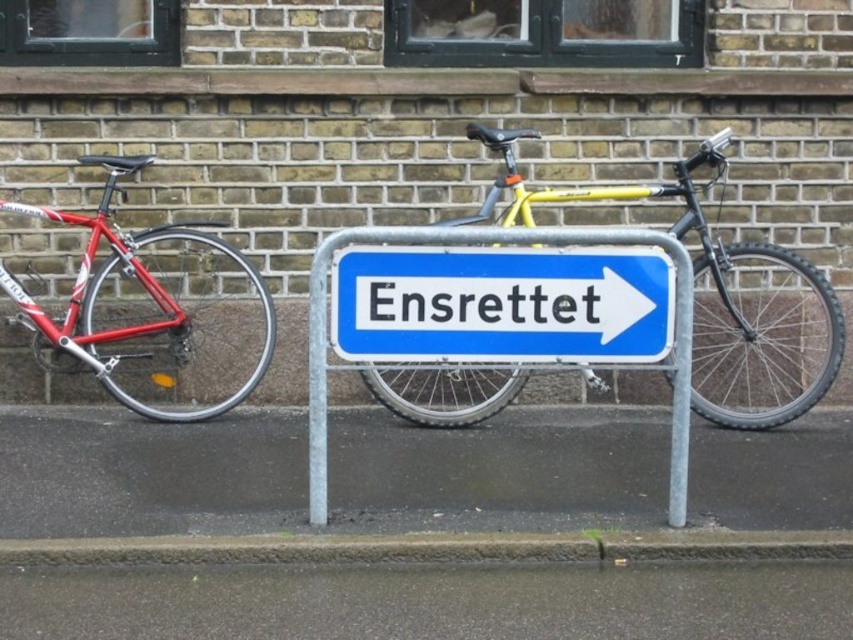
Question: Which object appears farthest from the camera in this image?

Choices:
 (A) gray metallic pole at center
 (B) blue metallic sign at center

Answer: (B)

Question: Does blue metallic sign at center have a lesser width compared to metallic blue sign at center?

Choices:
 (A) no
 (B) yes

Answer: (B)

Question: Can you confirm if blue metallic sign at center is thinner than gray metallic pole at center?

Choices:
 (A) yes
 (B) no

Answer: (B)

Question: Among these points, which one is farthest from the camera?

Choices:
 (A) (485, 337)
 (B) (680, 490)

Answer: (B)

Question: Is metallic blue sign at center below gray metallic pole at center?

Choices:
 (A) yes
 (B) no

Answer: (B)

Question: Estimate the real-world distances between objects in this image. Which object is farther from the gray metallic pole at center?

Choices:
 (A) metallic blue sign at center
 (B) blue metallic sign at center
 (C) shiny red bicycle at left
 (D) yellow matte bicycle at center

Answer: (C)